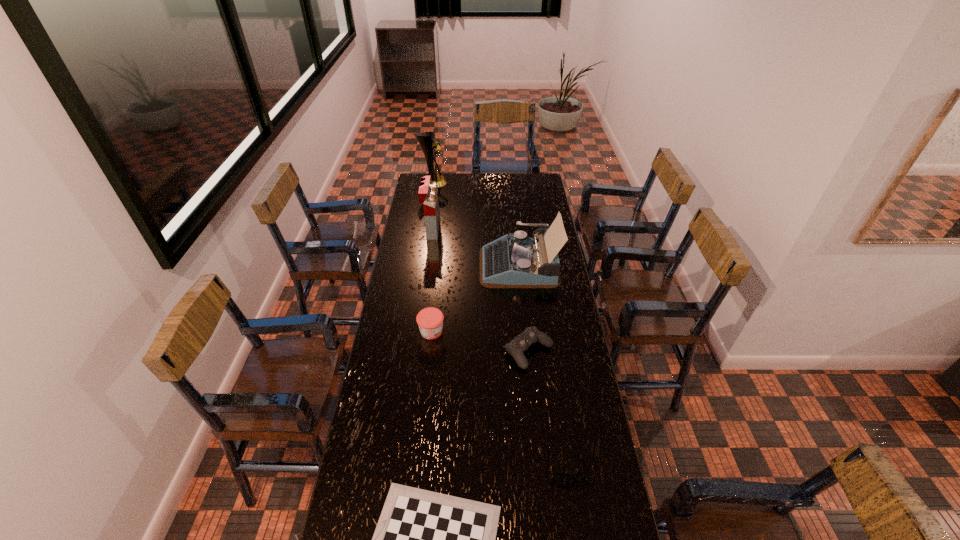
Locate an element on the screen. The width and height of the screenshot is (960, 540). the farthest object is located at coordinates (428, 144).

The height and width of the screenshot is (540, 960). I want to click on award, so click(x=428, y=144).

Where is `the sixth nearest object`? the sixth nearest object is located at coordinates (428, 194).

In order to click on typewriter in this screenshot , I will do `click(514, 260)`.

Where is `jam`? jam is located at coordinates (430, 320).

The width and height of the screenshot is (960, 540). What are the coordinates of `the fifth tallest object` in the screenshot? It's located at point(530,335).

Locate an element on the screen. This screenshot has height=540, width=960. the sixth farthest object is located at coordinates (557, 476).

You are a GUI agent. You are given a task and a screenshot of the screen. Output one action in this format:
    pyautogui.click(x=<x>, y=<y>)
    Task: Click on the second shortest object
    Image resolution: width=960 pixels, height=540 pixels.
    Given the screenshot: What is the action you would take?
    point(557,476)

The width and height of the screenshot is (960, 540). I want to click on blank area located 0.230m at the front of the award, where the globe is visible, so click(x=484, y=183).

Identify the location of free point located 0.270m with the lid open on the cigarette case. This screenshot has width=960, height=540. (490, 230).